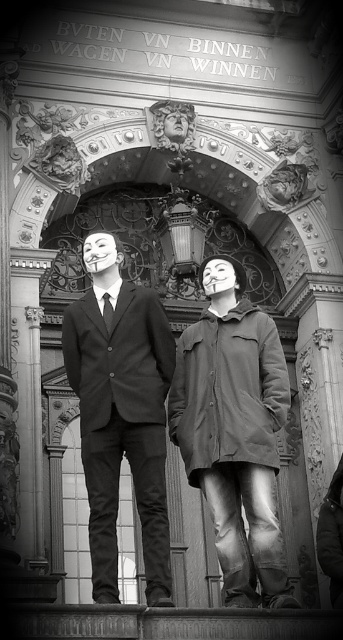
Between point (246, 566) and point (115, 356), which one is positioned in front?

Positioned in front is point (246, 566).

Is matte black coat at center in front of matte black suit at center?

No, matte black coat at center is further to the viewer.

Who is more forward, (253, 461) or (155, 292)?

Point (253, 461) is more forward.

This screenshot has height=640, width=343. I want to click on matte black coat at center, so click(233, 432).